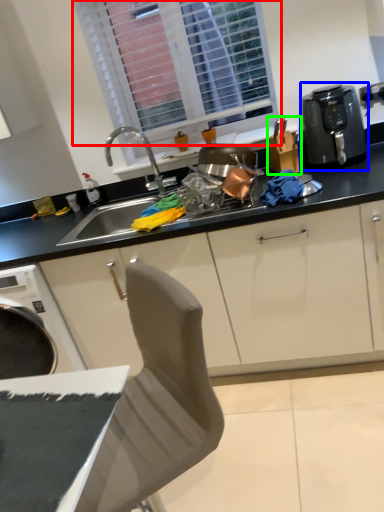
Question: Which object is positioned closest to window (highlighted by a red box)? Select from kitchen appliance (highlighted by a blue box) and appliance (highlighted by a green box).

Choices:
 (A) kitchen appliance
 (B) appliance

Answer: (B)